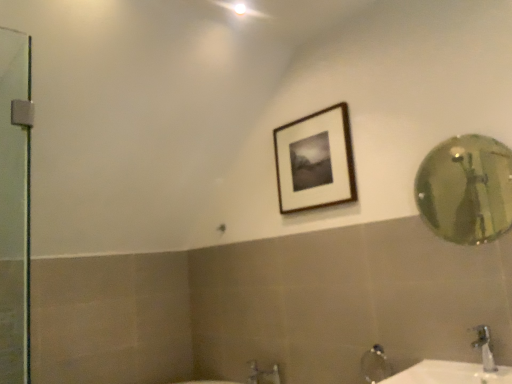
Question: Do you think silver metallic faucet at lower right is within gold reflective mirror at right, or outside of it?

Choices:
 (A) inside
 (B) outside

Answer: (B)

Question: Is silver metallic faucet at lower right bigger or smaller than gold reflective mirror at right?

Choices:
 (A) small
 (B) big

Answer: (A)

Question: Which object is positioned farthest from the silver metallic faucet at lower right?

Choices:
 (A) gold reflective mirror at right
 (B) wooden framed picture at upper center
 (C) white glossy sink at lower right

Answer: (A)

Question: Which object is the farthest from the gold reflective mirror at right?

Choices:
 (A) white glossy sink at lower right
 (B) silver metallic faucet at lower right
 (C) wooden framed picture at upper center

Answer: (B)